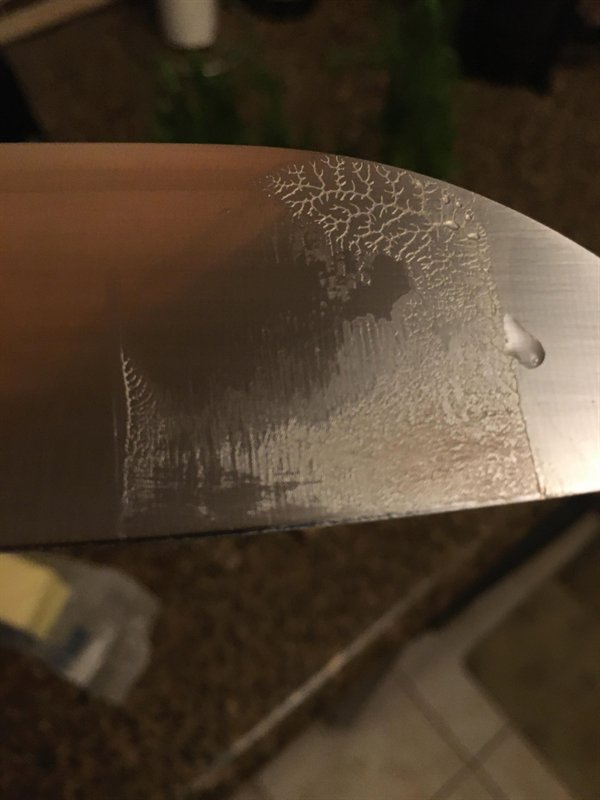
Where is `mug`? The image size is (600, 800). mug is located at coordinates (186, 34).